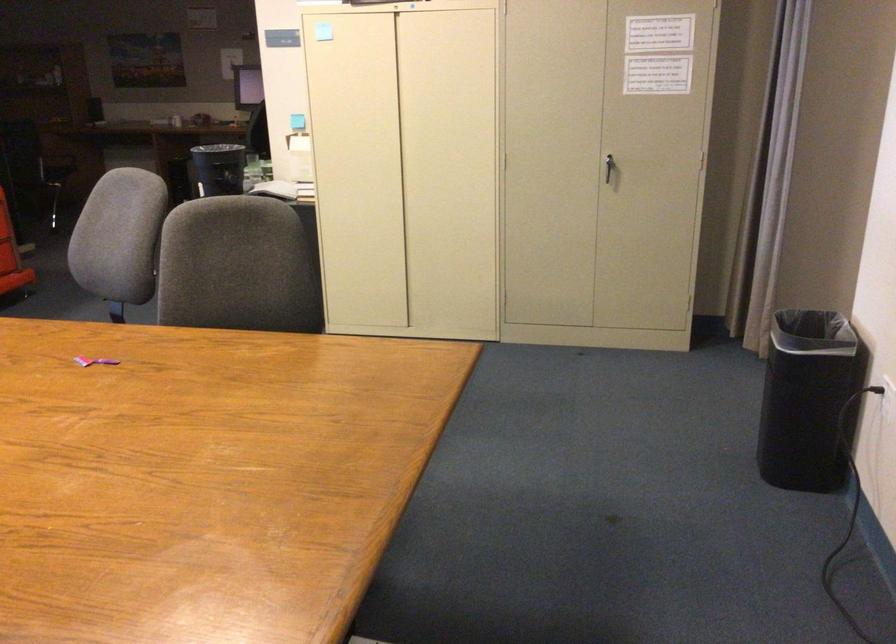
The height and width of the screenshot is (644, 896). In order to click on black wall plug in this screenshot , I will do `click(848, 512)`.